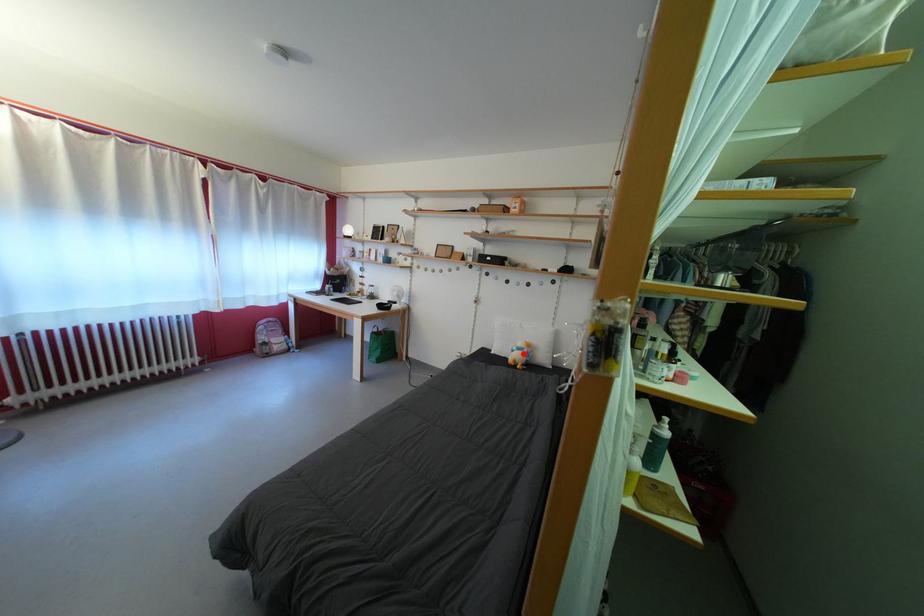
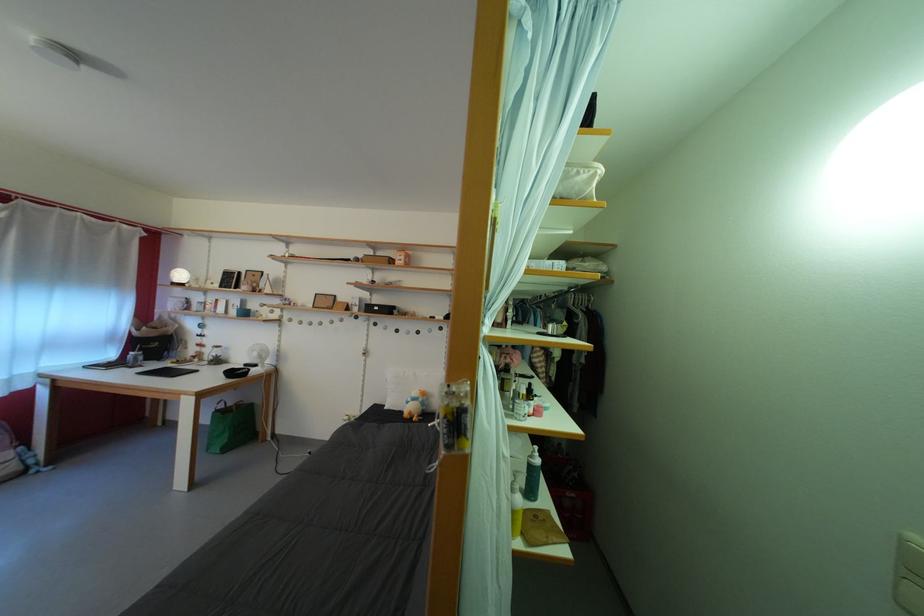
Locate, in the second image, the point that corresponds to the highlighted location in the first image.

(418, 405)